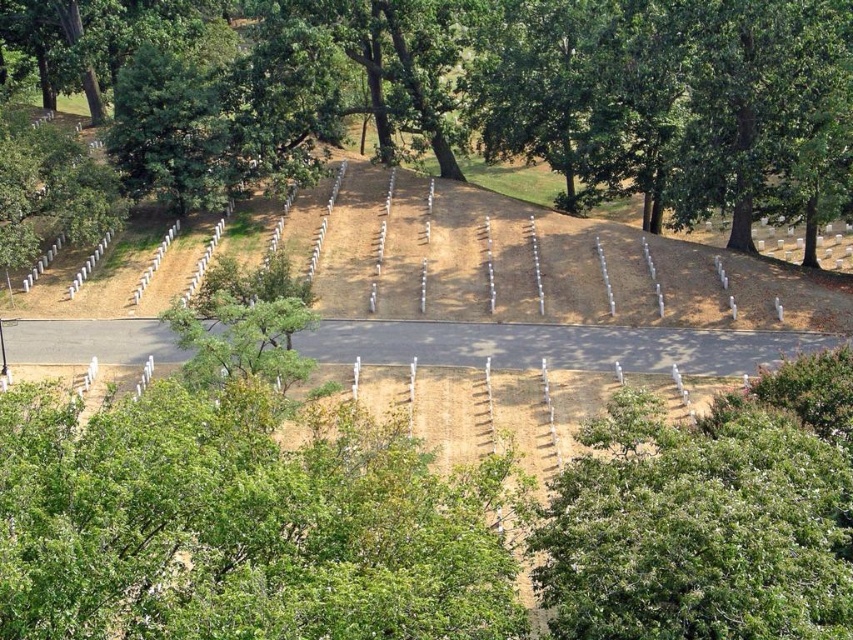
Question: Considering the relative positions of green leafy tree at center and white wooden markers at center in the image provided, where is green leafy tree at center located with respect to white wooden markers at center?

Choices:
 (A) left
 (B) right

Answer: (A)

Question: Is green leafy tree at center positioned in front of white wooden markers at center?

Choices:
 (A) no
 (B) yes

Answer: (A)

Question: Which point is farther to the camera?

Choices:
 (A) (328, 307)
 (B) (703, 144)

Answer: (B)

Question: Is the position of green leafy tree at center more distant than that of white wooden markers at center?

Choices:
 (A) yes
 (B) no

Answer: (A)

Question: Which point appears closest to the camera in this image?

Choices:
 (A) tap(415, 294)
 (B) tap(635, 180)

Answer: (A)